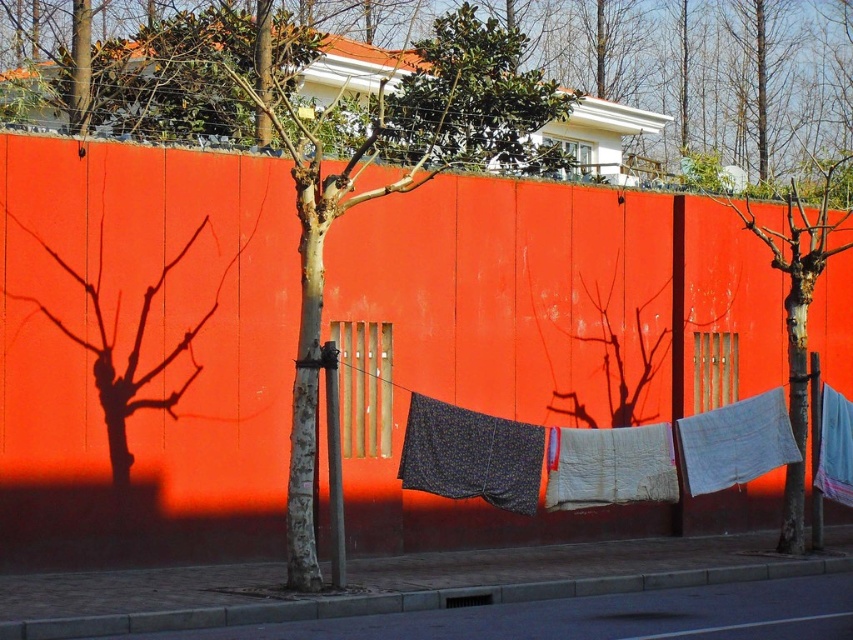
Is bare wood tree at center bigger than light blue cotton cloth at center right?

Correct, bare wood tree at center is larger in size than light blue cotton cloth at center right.

Does bare wood tree at center have a smaller size compared to light blue cotton cloth at center right?

No.

Locate an element on the screen. bare wood tree at center is located at coordinates (x=799, y=314).